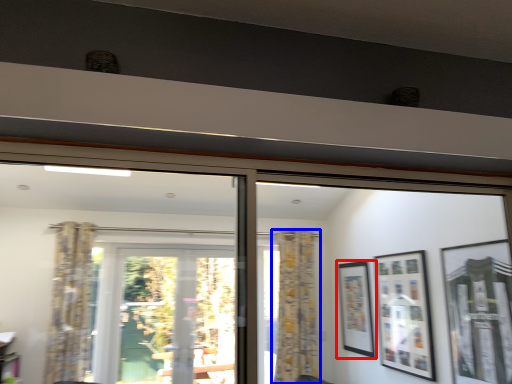
Question: Among these objects, which one is farthest to the camera, picture frame (highlighted by a red box) or curtain (highlighted by a blue box)?

Choices:
 (A) picture frame
 (B) curtain

Answer: (B)